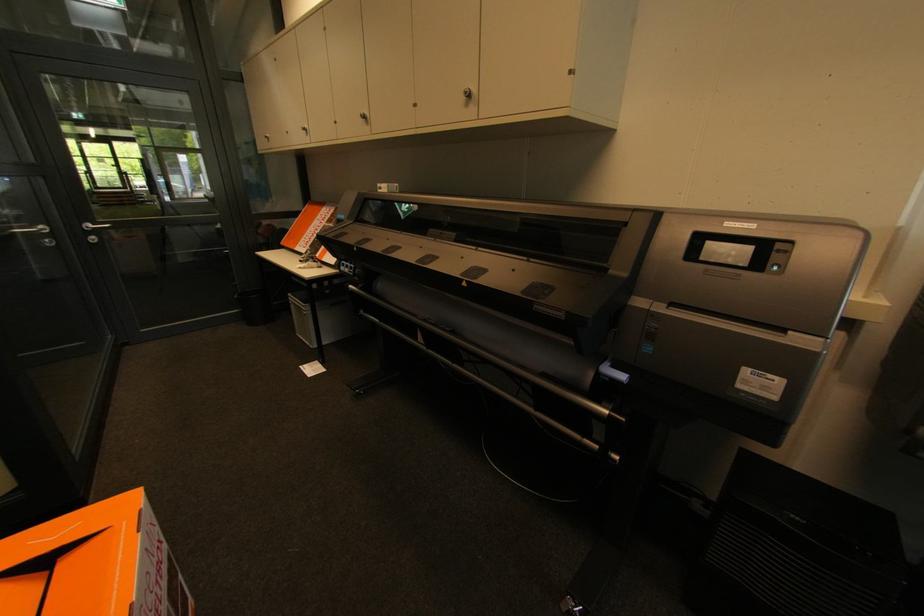
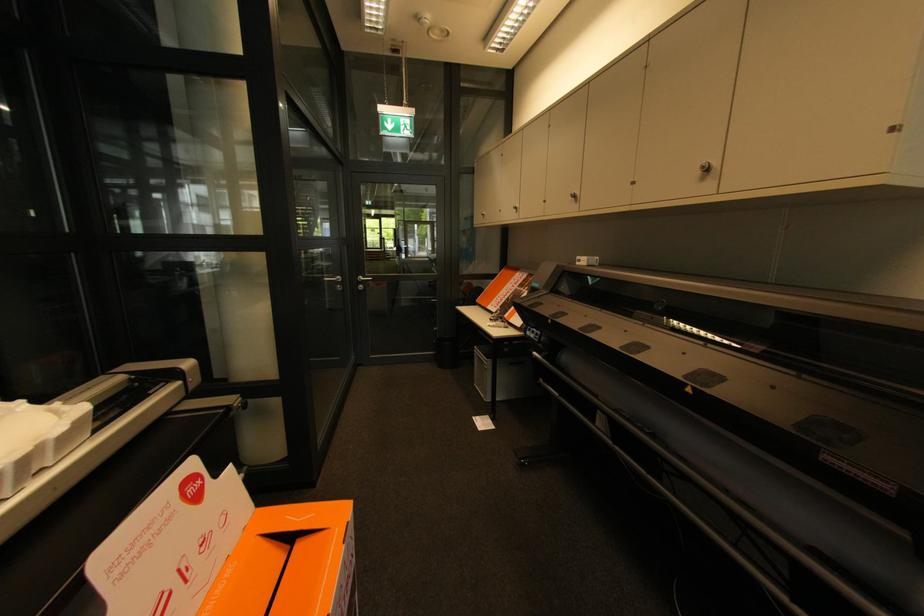
Locate, in the second image, the point that corresponds to (x=469, y=92) in the first image.

(707, 168)